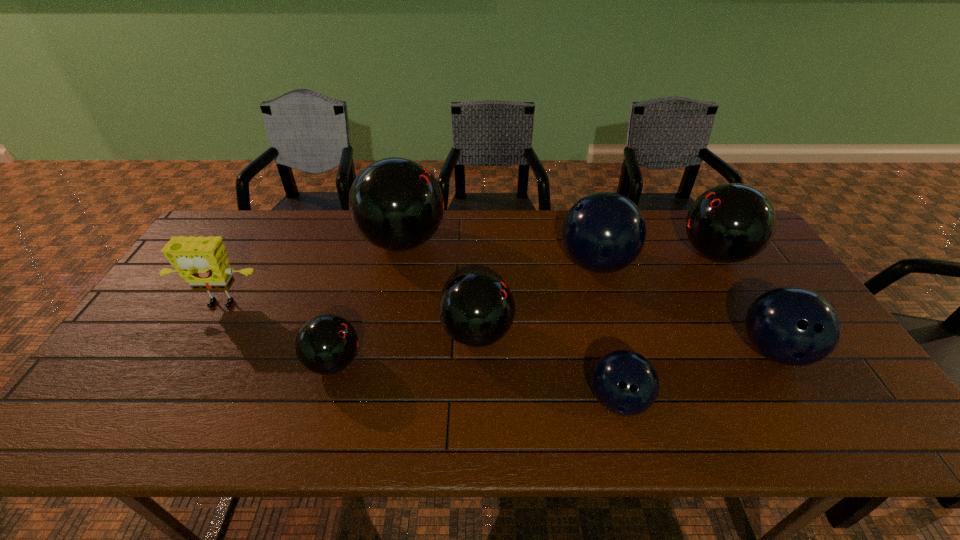
Select which bowling ball is the second closest to the second biggest black bowling ball. Please provide its 2D coordinates. Your answer should be formatted as a tuple, i.e. [(x, y)], where the tuple contains the x and y coordinates of a point satisfying the conditions above.

[(794, 326)]

Identify the location of black bowling ball that is the fourth closest to the rightmost blue bowling ball. (326, 344).

What are the coordinates of `black bowling ball that stands as the second closest to the farthest blue bowling ball` in the screenshot? It's located at (476, 309).

Select which blue bowling ball appears as the closest to the yellow sponge. Please provide its 2D coordinates. Your answer should be formatted as a tuple, i.e. [(x, y)], where the tuple contains the x and y coordinates of a point satisfying the conditions above.

[(604, 232)]

Where is `blue bowling ball that is the second nearest to the rightmost black bowling ball`? blue bowling ball that is the second nearest to the rightmost black bowling ball is located at coordinates (794, 326).

This screenshot has width=960, height=540. I want to click on vacant space that satisfies the following two spatial constraints: 1. on the surface of the rightmost black bowling ball near the finger holes; 2. on the front-facing side of the yellow sponge, so click(x=747, y=306).